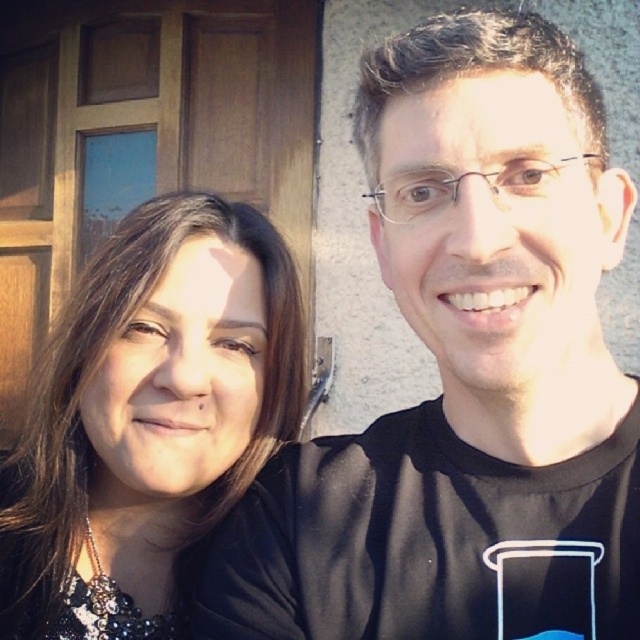
Question: Which of the following is the farthest from the observer?

Choices:
 (A) black fabric at left
 (B) black matte shirt at right

Answer: (A)

Question: Is black matte shirt at right bigger than black fabric at left?

Choices:
 (A) no
 (B) yes

Answer: (B)

Question: Can you confirm if black matte shirt at right is positioned to the left of black fabric at left?

Choices:
 (A) yes
 (B) no

Answer: (B)

Question: Which of the following is the closest to the observer?

Choices:
 (A) black matte shirt at right
 (B) black fabric at left

Answer: (A)

Question: Which point is farther to the camera?

Choices:
 (A) (460, 406)
 (B) (266, 243)

Answer: (B)

Question: Is black matte shirt at right bigger than black fabric at left?

Choices:
 (A) yes
 (B) no

Answer: (A)